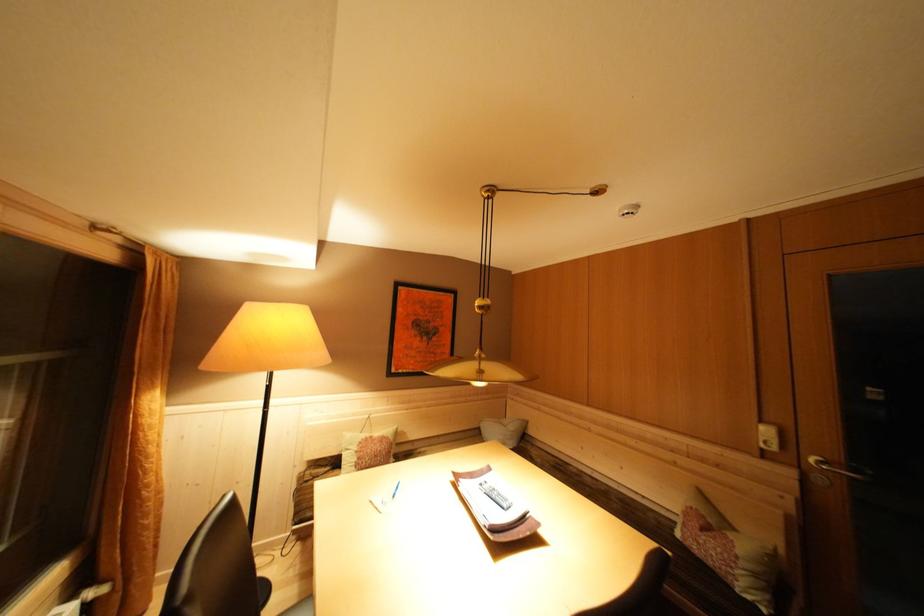
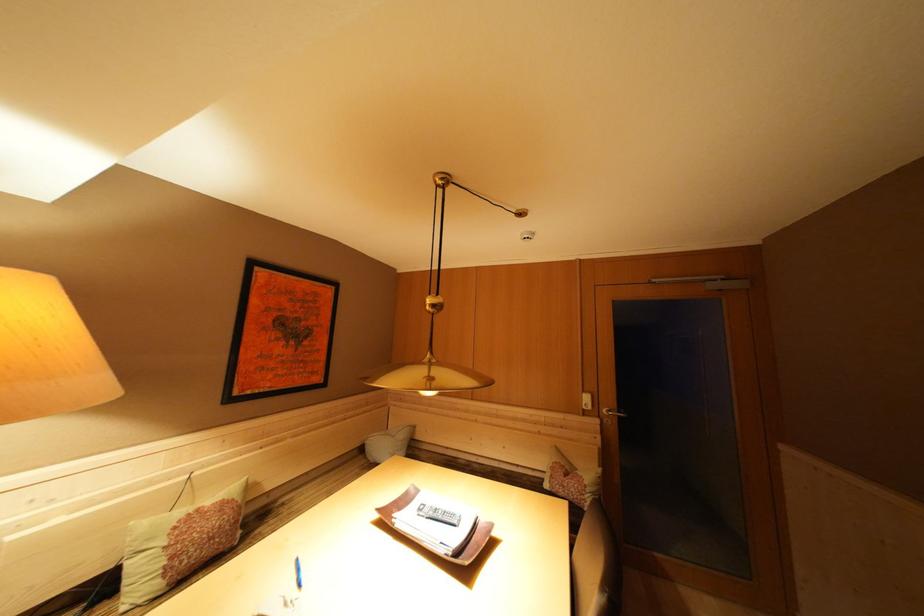
The point at (378, 442) is marked in the first image. Where is the corresponding point in the second image?

(204, 515)